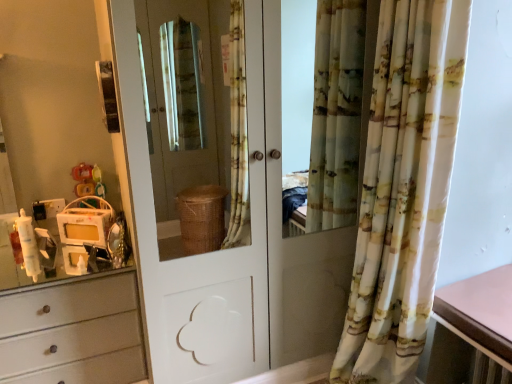
Describe the element at coordinates (88, 180) in the screenshot. I see `plastic yellow toy at left` at that location.

Measure the distance between white glossy door at center and camera.

white glossy door at center is 2.89 meters from camera.

The image size is (512, 384). Describe the element at coordinates (196, 182) in the screenshot. I see `white glossy door at center` at that location.

What is the approximate height of pink laminate table at right?

4.19 inches.

You are a GUI agent. You are given a task and a screenshot of the screen. Output one action in this format:
    pyautogui.click(x=<x>, y=<y>)
    Task: Click on the printed fabric curtain at right
    Image resolution: width=512 pixels, height=384 pixels.
    Given the screenshot: What is the action you would take?
    pyautogui.click(x=404, y=188)

From a real-world perspective, does printed fabric curtain at right stand above white glossy door at center?

No, from a real-world perspective, printed fabric curtain at right is not above white glossy door at center.

The width and height of the screenshot is (512, 384). In order to click on curtain in front of the white glossy door at center in this screenshot , I will do `click(404, 188)`.

Which is behind, printed fabric curtain at right or white glossy door at center?

white glossy door at center is further from the camera.

Is printed fabric curtain at right positioned with its back to white glossy door at center?

No, printed fabric curtain at right is not facing the opposite direction of white glossy door at center.

Is white glossy door at center thinner than pink laminate table at right?

Incorrect, the width of white glossy door at center is not less than that of pink laminate table at right.

From a real-world perspective, which object rests below the other?

pink laminate table at right.

Consider the image. Who is smaller, white glossy door at center or pink laminate table at right?

Smaller between the two is pink laminate table at right.

Based on the photo, can you confirm if plastic yellow toy at left is wider than printed fabric curtain at right?

In fact, plastic yellow toy at left might be narrower than printed fabric curtain at right.

Considering the positions of points (87, 206) and (386, 82), is point (87, 206) closer to camera compared to point (386, 82)?

That is False.

Is plastic yellow toy at left facing away from printed fabric curtain at right?

No, plastic yellow toy at left's orientation is not away from printed fabric curtain at right.

Does white glossy door at center come behind plastic yellow toy at left?

No.

In the scene shown: Considering the positions of objects white glossy door at center and plastic yellow toy at left in the image provided, who is more to the right, white glossy door at center or plastic yellow toy at left?

white glossy door at center.

How different are the orientations of white glossy door at center and plastic yellow toy at left in degrees?

There is a 2.82-degree angle between the facing directions of white glossy door at center and plastic yellow toy at left.

Based on their positions, is pink laminate table at right located to the left or right of plastic yellow toy at left?

In the image, pink laminate table at right appears on the right side of plastic yellow toy at left.

Does point (487, 352) lie behind point (101, 188)?

No.

Is pink laminate table at right situated inside plastic yellow toy at left or outside?

pink laminate table at right is spatially situated outside plastic yellow toy at left.

Is plastic yellow toy at left positioned with its back to pink laminate table at right?

Answer: No.

Consider the image. From the image's perspective, is plastic yellow toy at left beneath pink laminate table at right?

No, from the image's perspective, plastic yellow toy at left is not below pink laminate table at right.

Considering the points (98, 180) and (448, 318), which point is behind, point (98, 180) or point (448, 318)?

Positioned behind is point (98, 180).

Considering the positions of objects plastic yellow toy at left and pink laminate table at right in the image provided, who is more to the left, plastic yellow toy at left or pink laminate table at right?

Positioned to the left is plastic yellow toy at left.

Between point (95, 200) and point (206, 296), which one is positioned in front?

The point (206, 296) is closer to the camera.

Which object is more forward, plastic yellow toy at left or white glossy door at center?

white glossy door at center is more forward.

Consider the image. Is plastic yellow toy at left far away from white glossy door at center?

Yes.

At what (x,y) coordinates should I click in order to perform the action: click on door to the left of printed fabric curtain at right. Please return your answer as a coordinate pair (x, y). The image size is (512, 384). Looking at the image, I should click on (196, 182).

There is a pink laminate table at right. In order to click on door above it (from a real-world perspective) in this screenshot , I will do `click(196, 182)`.

Estimate the real-world distances between objects in this image. Which object is closer to plastic yellow toy at left, pink laminate table at right or white glossy door at center?

white glossy door at center lies closer to plastic yellow toy at left than the other object.

Estimate the real-world distances between objects in this image. Which object is closer to printed fabric curtain at right, plastic yellow toy at left or white glossy door at center?

plastic yellow toy at left lies closer to printed fabric curtain at right than the other object.

When comparing their distances from plastic yellow toy at left, does pink laminate table at right or printed fabric curtain at right seem closer?

printed fabric curtain at right lies closer to plastic yellow toy at left than the other object.

When comparing their distances from pink laminate table at right, does white glossy door at center or printed fabric curtain at right seem closer?

printed fabric curtain at right lies closer to pink laminate table at right than the other object.

Based on their spatial positions, is plastic yellow toy at left or white glossy door at center closer to pink laminate table at right?

plastic yellow toy at left lies closer to pink laminate table at right than the other object.

Considering their positions, is pink laminate table at right positioned further to white glossy door at center than plastic yellow toy at left?

pink laminate table at right is further to white glossy door at center.

Looking at this image, estimate the real-world distances between objects in this image. Which object is further from plastic yellow toy at left, printed fabric curtain at right or white glossy door at center?

white glossy door at center is positioned further to the anchor plastic yellow toy at left.

Considering their positions, is printed fabric curtain at right positioned further to white glossy door at center than plastic yellow toy at left?

printed fabric curtain at right.

Locate an element on the screen. The image size is (512, 384). door between plastic yellow toy at left and printed fabric curtain at right from left to right is located at coordinates (196, 182).

The width and height of the screenshot is (512, 384). What are the coordinates of `curtain situated between white glossy door at center and pink laminate table at right from left to right` in the screenshot? It's located at (404, 188).

Where is `curtain between plastic yellow toy at left and pink laminate table at right`? The height and width of the screenshot is (384, 512). curtain between plastic yellow toy at left and pink laminate table at right is located at coordinates (404, 188).

This screenshot has width=512, height=384. In order to click on door between plastic yellow toy at left and pink laminate table at right in the horizontal direction in this screenshot , I will do `click(196, 182)`.